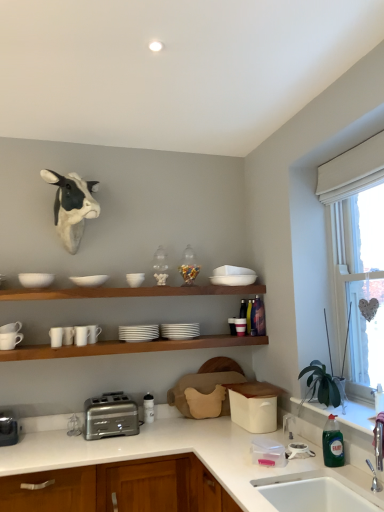
Find the location of `free spot below white matte plates at center, arranged as the 1th tableware when viewed from the right (from a real-world perspective)`. free spot below white matte plates at center, arranged as the 1th tableware when viewed from the right (from a real-world perspective) is located at coordinates (180, 336).